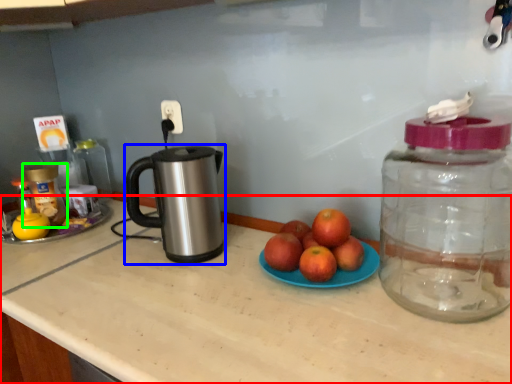
Question: Based on their relative distances, which object is nearer to countertop (highlighted by a red box)? Choose from kettle (highlighted by a blue box) and bottle (highlighted by a green box).

Choices:
 (A) kettle
 (B) bottle

Answer: (A)